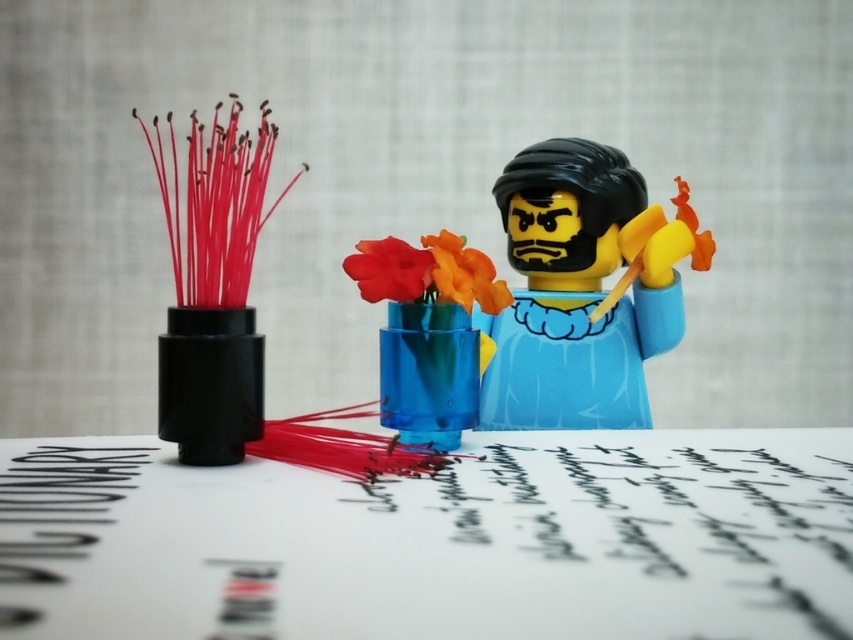
Question: Considering the real-world distances, which object is farthest from the translucent blue vase at center?

Choices:
 (A) orange matte flower at center
 (B) glossy plastic flower at center
 (C) matte blue plastic figurine at center

Answer: (C)

Question: Can you confirm if glossy plastic flower at center is thinner than orange matte flower at center?

Choices:
 (A) yes
 (B) no

Answer: (A)

Question: Is black matte hairpin at left closer to the viewer compared to glossy plastic flower at center?

Choices:
 (A) yes
 (B) no

Answer: (A)

Question: Which of these objects is positioned farthest from the white paper at center?

Choices:
 (A) glossy plastic flower at center
 (B) matte blue plastic figurine at center
 (C) orange matte flower at center

Answer: (B)

Question: In this image, where is glossy plastic flower at center located relative to orange matte flower at center?

Choices:
 (A) above
 (B) below

Answer: (A)

Question: Which object is closer to the camera taking this photo?

Choices:
 (A) black matte hairpin at left
 (B) glossy plastic flower at center
 (C) orange matte flower at center

Answer: (A)